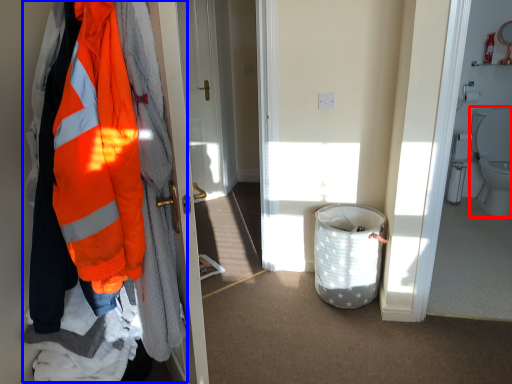
Question: Which object is further to the camera taking this photo, toilet (highlighted by a red box) or jacket (highlighted by a blue box)?

Choices:
 (A) toilet
 (B) jacket

Answer: (A)